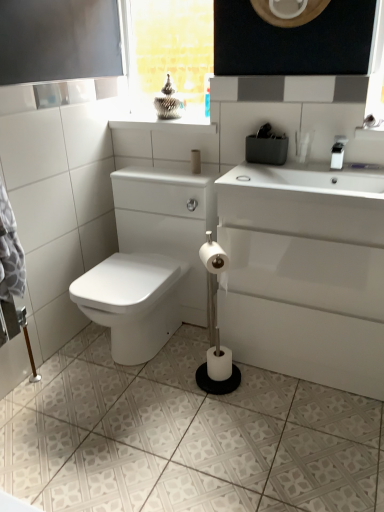
You are a GUI agent. You are given a task and a screenshot of the screen. Output one action in this format:
    pyautogui.click(x=<x>, y=<y>)
    Task: Click on the white plastic faucet at upper right
    This screenshot has height=512, width=384.
    Given the screenshot: What is the action you would take?
    pyautogui.click(x=338, y=152)

Describe the element at coordinates (184, 436) in the screenshot. I see `white glossy ceramic tile at lower center` at that location.

Describe the element at coordinates (215, 260) in the screenshot. I see `white matte toilet paper at center, which appears as the second toilet paper when viewed from the top` at that location.

The height and width of the screenshot is (512, 384). What are the coordinates of `white matte toilet paper at center, the 2th toilet paper from the bottom` in the screenshot? It's located at (215, 260).

The height and width of the screenshot is (512, 384). Describe the element at coordinates (169, 48) in the screenshot. I see `clear glass window at upper center` at that location.

Find the location of a particular element. The height and width of the screenshot is (512, 384). white plastic faucet at upper right is located at coordinates (338, 152).

Which of these two, white matte toilet paper at center, the 3th toilet paper in the top-to-bottom sequence, or white glossy porcelain at lower right, is bigger?

With larger size is white glossy porcelain at lower right.

From a real-world perspective, is white matte toilet paper at center, the 3th toilet paper in the top-to-bottom sequence, on top of white glossy porcelain at lower right?

Incorrect, from a real-world perspective, white matte toilet paper at center, the 3th toilet paper in the top-to-bottom sequence, is lower than white glossy porcelain at lower right.

From the image's perspective, which one is positioned higher, white matte toilet paper at center, the 1th toilet paper in the bottom-to-top sequence, or white glossy porcelain at lower right?

white glossy porcelain at lower right, from the image's perspective.

In terms of height, does white matte toilet paper at center, which is the second toilet paper from back to front, look taller or shorter compared to white matte toilet paper at center, the 1th toilet paper positioned from the front?

Clearly, white matte toilet paper at center, which is the second toilet paper from back to front, is shorter compared to white matte toilet paper at center, the 1th toilet paper positioned from the front.

How different are the orientations of white matte toilet paper at center, which is the second toilet paper from back to front, and white matte toilet paper at center, marked as the 3th toilet paper in a back-to-front arrangement, in degrees?

51.8 degrees.

Starting from the white matte toilet paper at center, the 1th toilet paper in the bottom-to-top sequence, which toilet paper is the 1st one to the left? Please provide its 2D coordinates.

[(215, 260)]

Is white matte toilet paper at center, the 3th toilet paper in the top-to-bottom sequence, not near white matte toilet paper at center, marked as the 3th toilet paper in a back-to-front arrangement?

No, white matte toilet paper at center, the 3th toilet paper in the top-to-bottom sequence, is not far from white matte toilet paper at center, marked as the 3th toilet paper in a back-to-front arrangement.

From a real-world perspective, is clear glass window at upper center below white matte soap at upper right?

No, from a real-world perspective, clear glass window at upper center is not under white matte soap at upper right.

Considering the positions of points (133, 95) and (241, 179), is point (133, 95) closer to camera compared to point (241, 179)?

No, (133, 95) is behind (241, 179).

Is white matte soap at upper right surrounded by clear glass window at upper center?

Actually, white matte soap at upper right is outside clear glass window at upper center.

Which object is positioned more to the left, clear glass window at upper center or white plastic faucet at upper right?

From the viewer's perspective, clear glass window at upper center appears more on the left side.

Does clear glass window at upper center have a larger size compared to white plastic faucet at upper right?

Yes.

Does point (173, 24) appear closer or farther from the camera than point (337, 168)?

Point (173, 24) appears to be farther away from the viewer than point (337, 168).

Looking at this image, is white plastic faucet at upper right surrounding clear glass window at upper center?

No, white plastic faucet at upper right does not contain clear glass window at upper center.

Is point (333, 153) closer to viewer compared to point (203, 12)?

Yes.

From a real-world perspective, is white plastic faucet at upper right located higher than clear glass window at upper center?

Actually, white plastic faucet at upper right is physically below clear glass window at upper center in the real world.

Can you confirm if white glossy ceramic tile at lower center is positioned to the right of white matte toilet paper at center, which appears as the second toilet paper when viewed from the top?

No, white glossy ceramic tile at lower center is not to the right of white matte toilet paper at center, which appears as the second toilet paper when viewed from the top.

Between white glossy ceramic tile at lower center and white matte toilet paper at center, the 2th toilet paper from the bottom, which one has smaller size?

With smaller size is white matte toilet paper at center, the 2th toilet paper from the bottom.

From the image's perspective, would you say white glossy ceramic tile at lower center is shown under white matte toilet paper at center, marked as the 3th toilet paper in a back-to-front arrangement?

Yes, from the image's perspective, white glossy ceramic tile at lower center is below white matte toilet paper at center, marked as the 3th toilet paper in a back-to-front arrangement.

Who is taller, white matte soap at upper right or white plastic faucet at upper right?

white plastic faucet at upper right.

Which object is more forward, white matte soap at upper right or white plastic faucet at upper right?

white plastic faucet at upper right.

Can you confirm if white matte soap at upper right is positioned to the right of white plastic faucet at upper right?

In fact, white matte soap at upper right is to the left of white plastic faucet at upper right.

Is white matte soap at upper right not close to white plastic faucet at upper right?

That's not correct — white matte soap at upper right is a little close to white plastic faucet at upper right.

Image resolution: width=384 pixels, height=512 pixels. In order to click on porcelain positioned vertically above the white matte toilet paper at center, the second toilet paper when ordered from front to back (from a real-world perspective) in this screenshot , I will do (x=305, y=273).

Find the location of a particular element. The width and height of the screenshot is (384, 512). the 1st toilet paper to the left of the white matte toilet paper at center, the 1th toilet paper in the bottom-to-top sequence, starting your count from the anchor is located at coordinates (215, 260).

Estimate the real-world distances between objects in this image. Which object is further from clear glass window at upper center, white plastic faucet at upper right or white glossy porcelain at lower right?

white plastic faucet at upper right.

When comparing their distances from matte beige toilet paper at center, acting as the 1th toilet paper starting from the top, does clear glass window at upper center or white matte toilet paper at center, which is the second toilet paper from back to front, seem closer?

Based on the image, white matte toilet paper at center, which is the second toilet paper from back to front, appears to be nearer to matte beige toilet paper at center, acting as the 1th toilet paper starting from the top.

From the picture: Considering their positions, is white matte toilet paper at center, the 3th toilet paper in the top-to-bottom sequence, positioned closer to white matte toilet paper at center, marked as the 3th toilet paper in a back-to-front arrangement, than clear glass window at upper center?

white matte toilet paper at center, the 3th toilet paper in the top-to-bottom sequence, lies closer to white matte toilet paper at center, marked as the 3th toilet paper in a back-to-front arrangement, than the other object.

Estimate the real-world distances between objects in this image. Which object is further from white glossy ceramic tile at lower center, white matte toilet paper at center, the 1th toilet paper positioned from the front, or white plastic faucet at upper right?

white plastic faucet at upper right lies further to white glossy ceramic tile at lower center than the other object.

From the image, which object appears to be nearer to white matte toilet paper at center, the second toilet paper when ordered from front to back, white glossy ceramic tile at lower center or matte beige toilet paper at center, acting as the 3th toilet paper starting from the front?

white glossy ceramic tile at lower center.

From the image, which object appears to be nearer to white matte soap at upper right, white glossy porcelain at lower right or white glossy ceramic tile at lower center?

white glossy porcelain at lower right.

Consider the image. From the image, which object appears to be nearer to clear glass window at upper center, white glossy ceramic tile at lower center or white plastic faucet at upper right?

Among the two, white glossy ceramic tile at lower center is located nearer to clear glass window at upper center.

Considering their positions, is matte beige toilet paper at center, acting as the 1th toilet paper starting from the top, positioned further to white glossy ceramic tile at lower center than white glossy porcelain at lower right?

The object further to white glossy ceramic tile at lower center is matte beige toilet paper at center, acting as the 1th toilet paper starting from the top.

Image resolution: width=384 pixels, height=512 pixels. What are the coordinates of `faucet between clear glass window at upper center and white matte soap at upper right vertically` in the screenshot? It's located at (338, 152).

I want to click on porcelain between white matte toilet paper at center, the 1th toilet paper positioned from the front, and white glossy ceramic tile at lower center in the up-down direction, so click(x=305, y=273).

The width and height of the screenshot is (384, 512). Identify the location of faucet between matte beige toilet paper at center, acting as the 1th toilet paper starting from the top, and white matte toilet paper at center, the 1th toilet paper in the bottom-to-top sequence, in the up-down direction. coord(338,152).

At what (x,y) coordinates should I click in order to perform the action: click on toilet paper that lies between white plastic faucet at upper right and white matte toilet paper at center, which is the second toilet paper from back to front, from top to bottom. Please return your answer as a coordinate pair (x, y). Looking at the image, I should click on (215, 260).